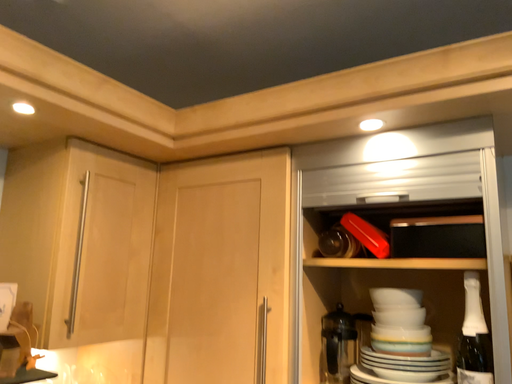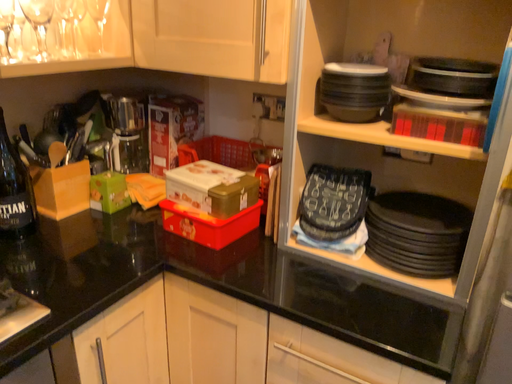
Question: Which way did the camera rotate in the video?

Choices:
 (A) rotated downward
 (B) rotated upward

Answer: (A)